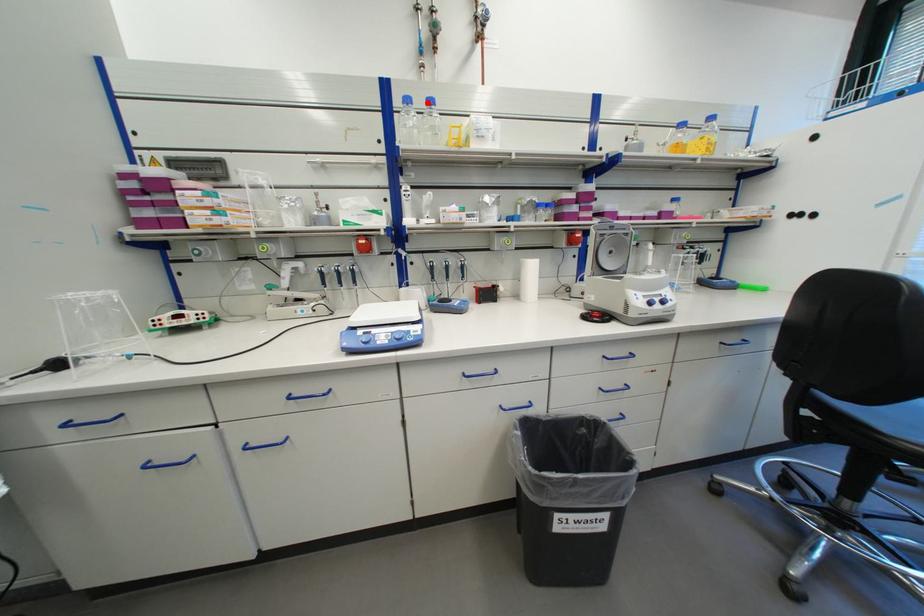
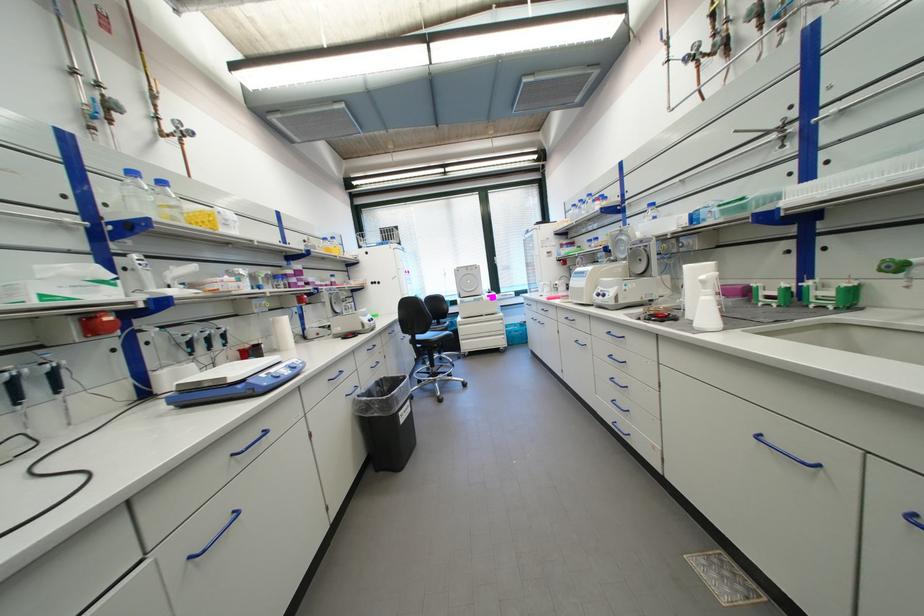
Where in the second image is the point corresponding to the highlighted location from the first image?

(156, 180)